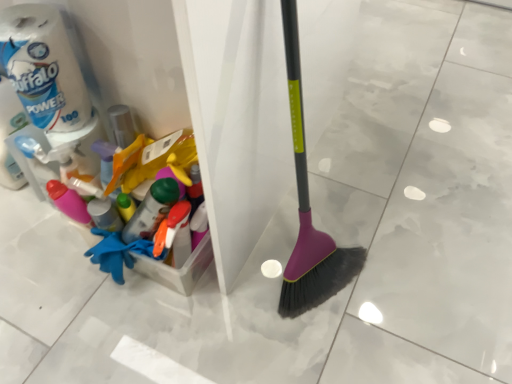
What do you see at coordinates (42, 67) in the screenshot? This screenshot has width=512, height=384. I see `white matte toilet paper at upper left, which ranks as the second toilet paper in left-to-right order` at bounding box center [42, 67].

This screenshot has height=384, width=512. What are the coordinates of `white matte toilet paper at upper left, which ranks as the second toilet paper in left-to-right order` in the screenshot? It's located at (42, 67).

Measure the distance between point (13, 169) and camera.

Point (13, 169) is 1.29 meters away from camera.

You are a GUI agent. You are given a task and a screenshot of the screen. Output one action in this format:
    pyautogui.click(x=<x>, y=<y>)
    Task: Click on the white matte toilet paper at left, which is the second toilet paper in right-to-left order
    This screenshot has width=512, height=384.
    Given the screenshot: What is the action you would take?
    pyautogui.click(x=11, y=134)

Measure the distance between white matte toilet paper at left, which is the second toilet paper in right-to-left order, and camera.

white matte toilet paper at left, which is the second toilet paper in right-to-left order, is 39.33 inches away from camera.

Describe the element at coordinates (11, 134) in the screenshot. I see `white matte toilet paper at left, arranged as the 1th toilet paper when viewed from the left` at that location.

The image size is (512, 384). Find the location of `white matte toilet paper at upper left, the 1th toilet paper in the right-to-left sequence`. white matte toilet paper at upper left, the 1th toilet paper in the right-to-left sequence is located at coordinates (42, 67).

Based on the photo, in the image, is white matte toilet paper at left, arranged as the 1th toilet paper when viewed from the left, on the left side or the right side of white matte toilet paper at upper left, which ranks as the second toilet paper in left-to-right order?

white matte toilet paper at left, arranged as the 1th toilet paper when viewed from the left, is positioned on white matte toilet paper at upper left, which ranks as the second toilet paper in left-to-right order,'s left side.

Is white matte toilet paper at left, arranged as the 1th toilet paper when viewed from the left, in front of or behind white matte toilet paper at upper left, which ranks as the second toilet paper in left-to-right order, in the image?

white matte toilet paper at left, arranged as the 1th toilet paper when viewed from the left, is behind white matte toilet paper at upper left, which ranks as the second toilet paper in left-to-right order.

Is point (9, 98) closer or farther from the camera than point (55, 86)?

Point (9, 98) is positioned farther from the camera compared to point (55, 86).

From the image's perspective, relative to white matte toilet paper at upper left, the 1th toilet paper in the right-to-left sequence, is white matte toilet paper at left, arranged as the 1th toilet paper when viewed from the left, above or below?

white matte toilet paper at left, arranged as the 1th toilet paper when viewed from the left, is below white matte toilet paper at upper left, the 1th toilet paper in the right-to-left sequence.

From a real-world perspective, who is located higher, white matte toilet paper at left, which is the second toilet paper in right-to-left order, or white matte toilet paper at upper left, which ranks as the second toilet paper in left-to-right order?

From a 3D spatial view, white matte toilet paper at upper left, which ranks as the second toilet paper in left-to-right order, is above.

Can you confirm if white matte toilet paper at left, arranged as the 1th toilet paper when viewed from the left, is thinner than white matte toilet paper at upper left, the 1th toilet paper in the right-to-left sequence?

No, white matte toilet paper at left, arranged as the 1th toilet paper when viewed from the left, is not thinner than white matte toilet paper at upper left, the 1th toilet paper in the right-to-left sequence.

Is white matte toilet paper at left, arranged as the 1th toilet paper when viewed from the left, taller than white matte toilet paper at upper left, the 1th toilet paper in the right-to-left sequence?

Indeed, white matte toilet paper at left, arranged as the 1th toilet paper when viewed from the left, has a greater height compared to white matte toilet paper at upper left, the 1th toilet paper in the right-to-left sequence.

Based on their sizes in the image, would you say white matte toilet paper at left, arranged as the 1th toilet paper when viewed from the left, is bigger or smaller than white matte toilet paper at upper left, which ranks as the second toilet paper in left-to-right order?

Considering their sizes, white matte toilet paper at left, arranged as the 1th toilet paper when viewed from the left, takes up more space than white matte toilet paper at upper left, which ranks as the second toilet paper in left-to-right order.

Is white matte toilet paper at left, which is the second toilet paper in right-to-left order, spatially inside white matte toilet paper at upper left, which ranks as the second toilet paper in left-to-right order, or outside of it?

white matte toilet paper at left, which is the second toilet paper in right-to-left order, cannot be found inside white matte toilet paper at upper left, which ranks as the second toilet paper in left-to-right order.

Is white matte toilet paper at left, which is the second toilet paper in right-to-left order, next to white matte toilet paper at upper left, the 1th toilet paper in the right-to-left sequence?

No, white matte toilet paper at left, which is the second toilet paper in right-to-left order, is not making contact with white matte toilet paper at upper left, the 1th toilet paper in the right-to-left sequence.

Is white matte toilet paper at left, which is the second toilet paper in right-to-left order, oriented away from white matte toilet paper at upper left, the 1th toilet paper in the right-to-left sequence?

No, white matte toilet paper at left, which is the second toilet paper in right-to-left order,'s orientation is not away from white matte toilet paper at upper left, the 1th toilet paper in the right-to-left sequence.

Where is `toilet paper located below the white matte toilet paper at upper left, which ranks as the second toilet paper in left-to-right order (from the image's perspective)`? This screenshot has width=512, height=384. toilet paper located below the white matte toilet paper at upper left, which ranks as the second toilet paper in left-to-right order (from the image's perspective) is located at coordinates (11, 134).

Can you confirm if white matte toilet paper at upper left, which ranks as the second toilet paper in left-to-right order, is positioned to the right of white matte toilet paper at left, arranged as the 1th toilet paper when viewed from the left?

Yes.

Who is more distant, white matte toilet paper at upper left, which ranks as the second toilet paper in left-to-right order, or white matte toilet paper at left, which is the second toilet paper in right-to-left order?

Positioned behind is white matte toilet paper at left, which is the second toilet paper in right-to-left order.

Is point (62, 87) more distant than point (23, 178)?

No, (62, 87) is closer to viewer.

From the image's perspective, is white matte toilet paper at upper left, the 1th toilet paper in the right-to-left sequence, located beneath white matte toilet paper at left, which is the second toilet paper in right-to-left order?

Actually, white matte toilet paper at upper left, the 1th toilet paper in the right-to-left sequence, appears above white matte toilet paper at left, which is the second toilet paper in right-to-left order, in the image.

From a real-world perspective, is white matte toilet paper at upper left, the 1th toilet paper in the right-to-left sequence, on white matte toilet paper at left, arranged as the 1th toilet paper when viewed from the left?

Yes, from a real-world perspective, white matte toilet paper at upper left, the 1th toilet paper in the right-to-left sequence, is on top of white matte toilet paper at left, arranged as the 1th toilet paper when viewed from the left.

Which object is wider, white matte toilet paper at upper left, the 1th toilet paper in the right-to-left sequence, or white matte toilet paper at left, arranged as the 1th toilet paper when viewed from the left?

Wider between the two is white matte toilet paper at left, arranged as the 1th toilet paper when viewed from the left.

Who is taller, white matte toilet paper at upper left, the 1th toilet paper in the right-to-left sequence, or white matte toilet paper at left, arranged as the 1th toilet paper when viewed from the left?

white matte toilet paper at left, arranged as the 1th toilet paper when viewed from the left.

Considering the relative sizes of white matte toilet paper at upper left, the 1th toilet paper in the right-to-left sequence, and white matte toilet paper at left, which is the second toilet paper in right-to-left order, in the image provided, is white matte toilet paper at upper left, the 1th toilet paper in the right-to-left sequence, smaller than white matte toilet paper at left, which is the second toilet paper in right-to-left order,?

Indeed, white matte toilet paper at upper left, the 1th toilet paper in the right-to-left sequence, has a smaller size compared to white matte toilet paper at left, which is the second toilet paper in right-to-left order.

Can white matte toilet paper at left, which is the second toilet paper in right-to-left order, be found inside white matte toilet paper at upper left, which ranks as the second toilet paper in left-to-right order?

Actually, white matte toilet paper at left, which is the second toilet paper in right-to-left order, is outside white matte toilet paper at upper left, which ranks as the second toilet paper in left-to-right order.

Is white matte toilet paper at upper left, which ranks as the second toilet paper in left-to-right order, next to white matte toilet paper at left, arranged as the 1th toilet paper when viewed from the left, and touching it?

No, white matte toilet paper at upper left, which ranks as the second toilet paper in left-to-right order, is not in contact with white matte toilet paper at left, arranged as the 1th toilet paper when viewed from the left.

Based on the photo, is white matte toilet paper at left, arranged as the 1th toilet paper when viewed from the left, at the back of white matte toilet paper at upper left, the 1th toilet paper in the right-to-left sequence?

No, white matte toilet paper at upper left, the 1th toilet paper in the right-to-left sequence, is not facing the opposite direction of white matte toilet paper at left, arranged as the 1th toilet paper when viewed from the left.

Image resolution: width=512 pixels, height=384 pixels. Find the location of `toilet paper that is on the right side of white matte toilet paper at left, arranged as the 1th toilet paper when viewed from the left`. toilet paper that is on the right side of white matte toilet paper at left, arranged as the 1th toilet paper when viewed from the left is located at coordinates (42, 67).

Where is `toilet paper on the right of white matte toilet paper at left, which is the second toilet paper in right-to-left order`? toilet paper on the right of white matte toilet paper at left, which is the second toilet paper in right-to-left order is located at coordinates (42, 67).

This screenshot has height=384, width=512. In order to click on toilet paper located behind the white matte toilet paper at upper left, which ranks as the second toilet paper in left-to-right order in this screenshot , I will do `click(11, 134)`.